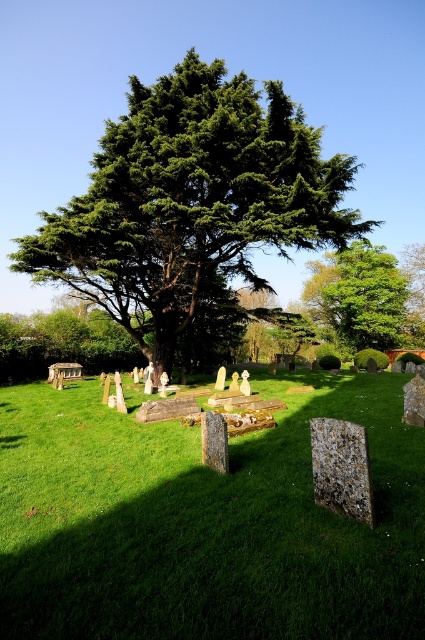
Looking at this image, how distant is green leafy tree at upper right from speckled stone gravestone at lower center?

green leafy tree at upper right is 39.99 meters from speckled stone gravestone at lower center.

Does green leafy tree at upper right appear on the left side of speckled stone gravestone at lower center?

Incorrect, green leafy tree at upper right is not on the left side of speckled stone gravestone at lower center.

Does point (328, 316) lie in front of point (314, 444)?

No, (328, 316) is behind (314, 444).

This screenshot has width=425, height=640. What are the coordinates of `green leafy tree at upper right` in the screenshot? It's located at (363, 296).

Can you confirm if green leafy tree at upper center is wider than speckled stone gravestone at lower center?

Indeed, green leafy tree at upper center has a greater width compared to speckled stone gravestone at lower center.

You are a GUI agent. You are given a task and a screenshot of the screen. Output one action in this format:
    pyautogui.click(x=<x>, y=<y>)
    Task: Click on the green leafy tree at upper center
    
    Given the screenshot: What is the action you would take?
    pyautogui.click(x=190, y=202)

This screenshot has width=425, height=640. Identify the location of green leafy tree at upper center. (190, 202).

Can you confirm if green leafy tree at upper center is positioned to the left of green leafy tree at upper right?

Correct, you'll find green leafy tree at upper center to the left of green leafy tree at upper right.

Which of these two, green leafy tree at upper center or green leafy tree at upper right, stands taller?

With more height is green leafy tree at upper center.

Does point (91, 189) come in front of point (362, 250)?

That is True.

Locate an element on the screen. The image size is (425, 640). green leafy tree at upper center is located at coordinates (190, 202).